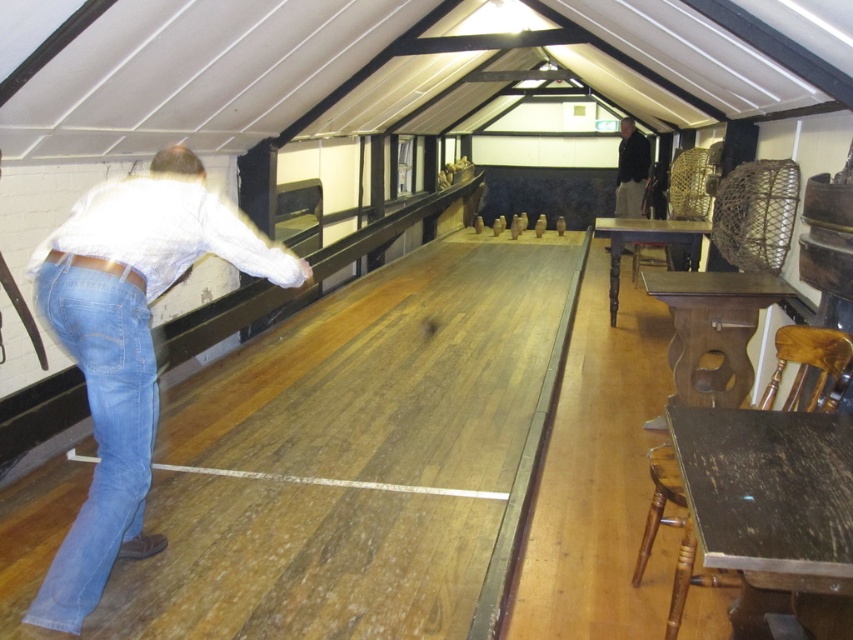
Is point (122, 202) closer to camera compared to point (631, 192)?

Yes, point (122, 202) is in front of point (631, 192).

The height and width of the screenshot is (640, 853). I want to click on blue denim jeans at left, so click(x=126, y=348).

You are a GUI agent. You are given a task and a screenshot of the screen. Output one action in this format:
    pyautogui.click(x=<x>, y=<y>)
    Task: Click on the blue denim jeans at left
    
    Given the screenshot: What is the action you would take?
    pyautogui.click(x=126, y=348)

Find the location of `blue denim jeans at left`. blue denim jeans at left is located at coordinates (126, 348).

From the picture: Does blue denim jeans at left have a greater width compared to blue denim jeans at lower left?

Yes.

Which of these two, blue denim jeans at left or blue denim jeans at lower left, stands taller?

Standing taller between the two is blue denim jeans at left.

Does point (80, 266) lie behind point (109, 358)?

Yes, it is.

This screenshot has height=640, width=853. Find the location of `blue denim jeans at left`. blue denim jeans at left is located at coordinates (126, 348).

Does blue denim jeans at lower left have a larger size compared to black fabric at right?

Actually, blue denim jeans at lower left might be smaller than black fabric at right.

Measure the distance between point [144,550] and camera.

Point [144,550] is 8.27 feet from camera.

The width and height of the screenshot is (853, 640). Describe the element at coordinates (100, 429) in the screenshot. I see `blue denim jeans at lower left` at that location.

Locate an element on the screen. blue denim jeans at lower left is located at coordinates (100, 429).